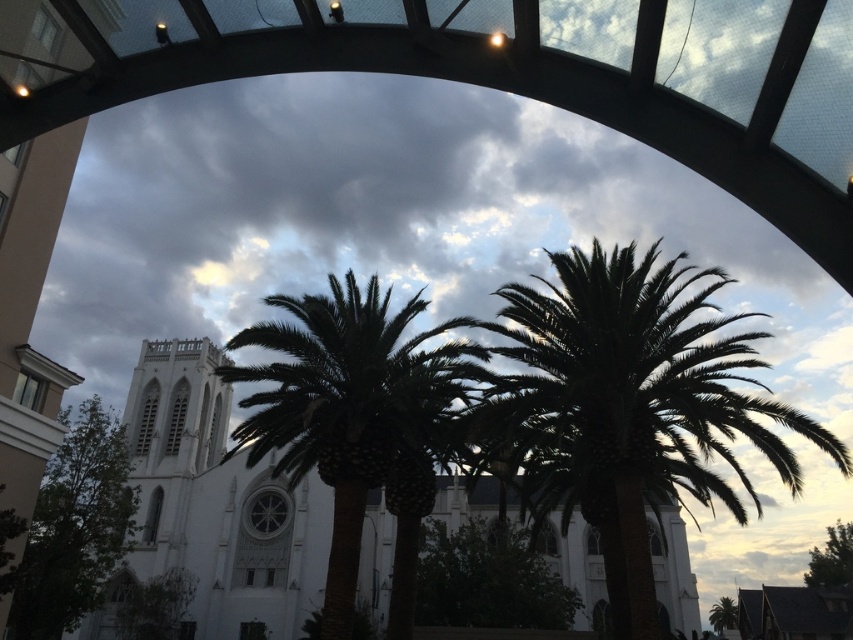
Can you confirm if white smooth church at center is taller than green leafy tree at center?

Correct, white smooth church at center is much taller as green leafy tree at center.

Is point (149, 372) positioned after point (495, 547)?

Yes.

Is point (206, 573) positioned in front of point (527, 531)?

No, (206, 573) is behind (527, 531).

Identify the location of white smooth church at center. This screenshot has height=640, width=853. (213, 506).

Is point (318, 563) farther from camera compared to point (369, 467)?

Yes, point (318, 563) is behind point (369, 467).

Between white smooth church at center and green leafy palm tree at center, which one appears on the right side from the viewer's perspective?

From the viewer's perspective, white smooth church at center appears more on the right side.

Which is in front, point (277, 499) or point (380, 300)?

Positioned in front is point (380, 300).

What are the coordinates of `white smooth church at center` in the screenshot? It's located at (213, 506).

Is point (215, 531) behind point (843, 564)?

No.

Image resolution: width=853 pixels, height=640 pixels. What do you see at coordinates (213, 506) in the screenshot? I see `white smooth church at center` at bounding box center [213, 506].

Does point (238, 586) come closer to viewer compared to point (839, 552)?

Yes.

The image size is (853, 640). I want to click on white smooth church at center, so click(213, 506).